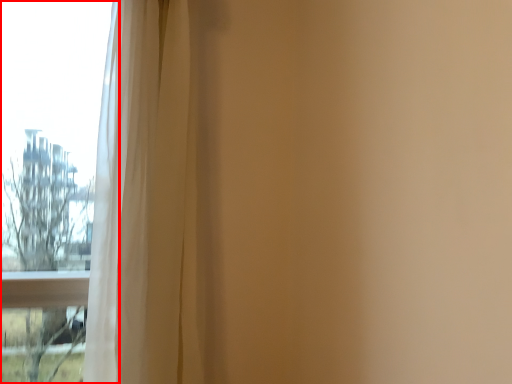
Question: From the image, what is the correct spatial relationship of window (annotated by the red box) in relation to curtain?

Choices:
 (A) right
 (B) left

Answer: (B)